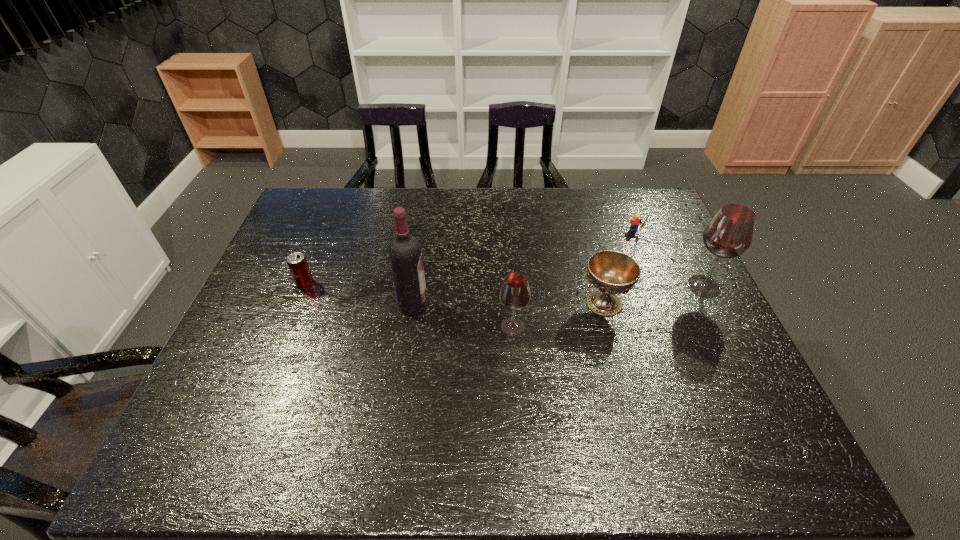
Where is `vacant space that satisfies the following two spatial constraints: 1. on the front-facing side of the fifth object from left to right; 2. on the right side of the second tallest object`? Image resolution: width=960 pixels, height=540 pixels. vacant space that satisfies the following two spatial constraints: 1. on the front-facing side of the fifth object from left to right; 2. on the right side of the second tallest object is located at coordinates (656, 286).